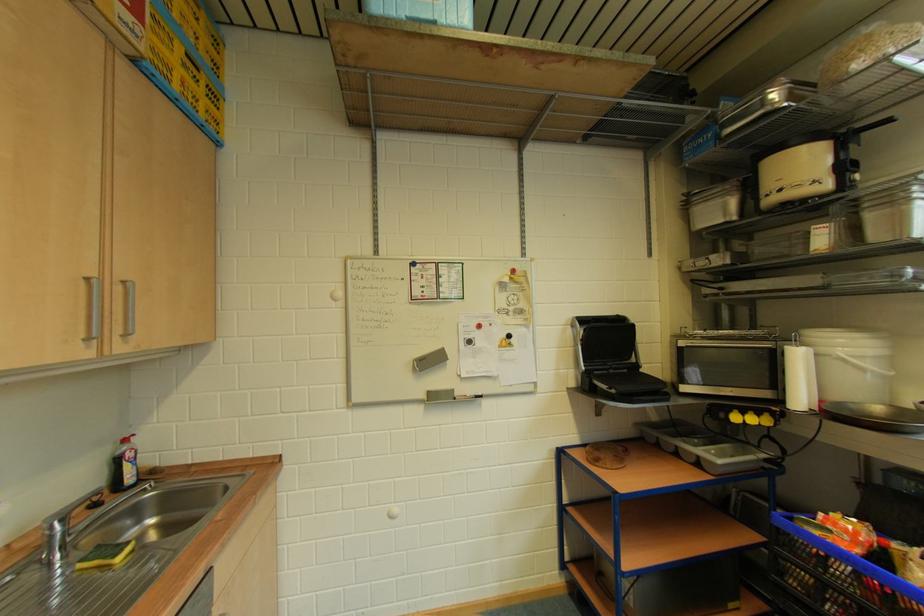
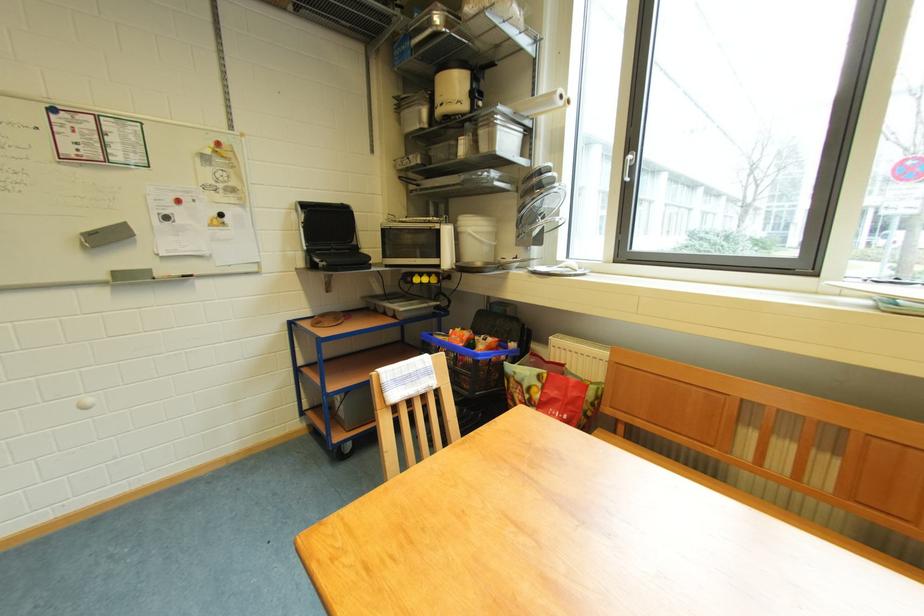
Find the pixel in the second image that matches [579,329] in the first image.

(305, 214)